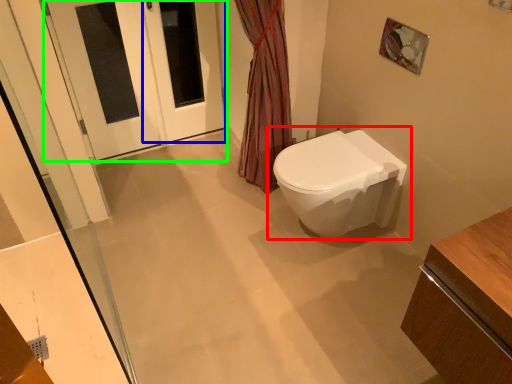
Question: Based on their relative distances, which object is nearer to toilet (highlighted by a red box)? Choose from screen door (highlighted by a blue box) and door (highlighted by a green box).

Choices:
 (A) screen door
 (B) door

Answer: (A)